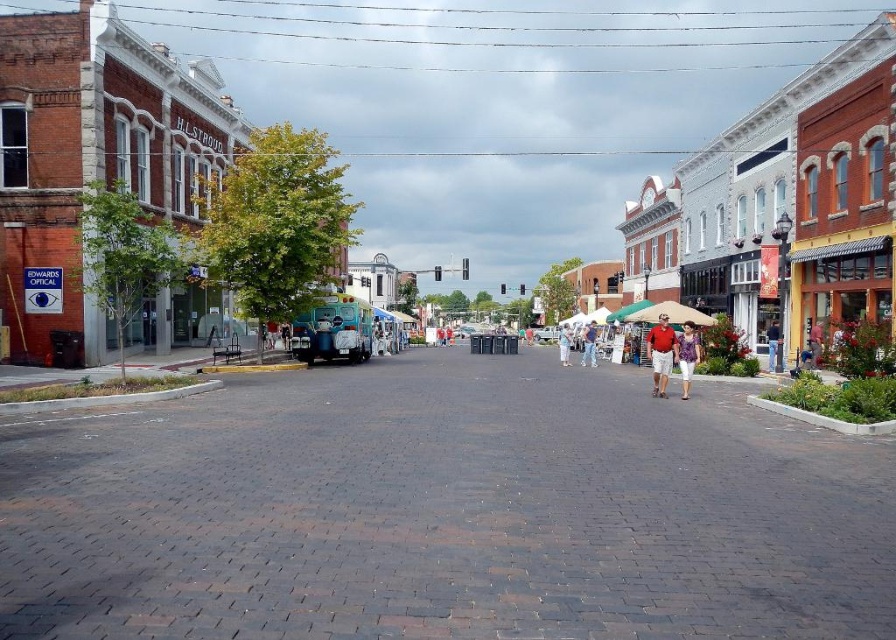
Question: Can you confirm if matte khaki shorts at center is positioned to the left of denim jeans at center?

Choices:
 (A) no
 (B) yes

Answer: (B)

Question: Is denim jacket at center thinner than denim jeans at center?

Choices:
 (A) yes
 (B) no

Answer: (A)

Question: Which object is farther from the camera taking this photo?

Choices:
 (A) denim jacket at center
 (B) denim jeans at center
 (C) matte teal van at center
 (D) light blue denim shorts at center

Answer: (C)

Question: Among these points, which one is nearest to the camera?

Choices:
 (A) (817, 324)
 (B) (580, 362)
 (C) (540, 336)
 (D) (679, 353)

Answer: (D)

Question: Is dark brick pavement at center to the right of denim jacket at center from the viewer's perspective?

Choices:
 (A) yes
 (B) no

Answer: (B)

Question: Which point appears farthest from the camera in this image?

Choices:
 (A) (549, 579)
 (B) (562, 324)
 (C) (662, 380)

Answer: (B)